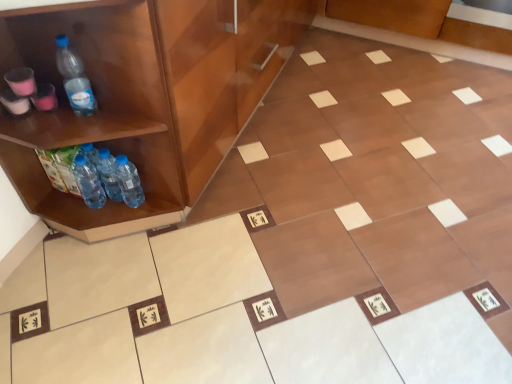
Locate an element on the screen. vacant area that is situated to the right of brown glossy cabinet at left is located at coordinates (386, 113).